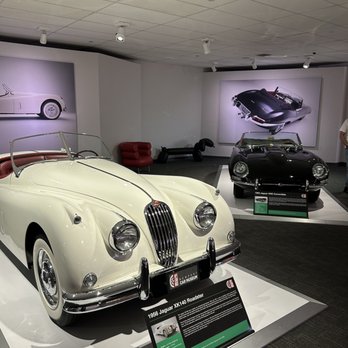
The height and width of the screenshot is (348, 348). What are the coordinates of `white display floor` in the screenshot? It's located at (276, 308), (34, 333), (326, 213), (215, 180).